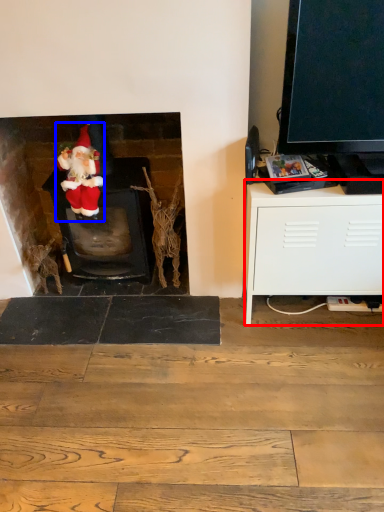
Question: Which object is further to the camera taking this photo, cabinetry (highlighted by a red box) or person (highlighted by a blue box)?

Choices:
 (A) cabinetry
 (B) person

Answer: (B)